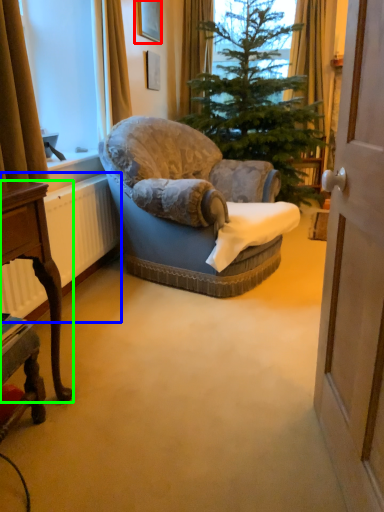
Question: Which object is the farthest from picture frame (highlighted by a red box)? Choose among these: radiator (highlighted by a blue box) or desk (highlighted by a green box).

Choices:
 (A) radiator
 (B) desk

Answer: (B)